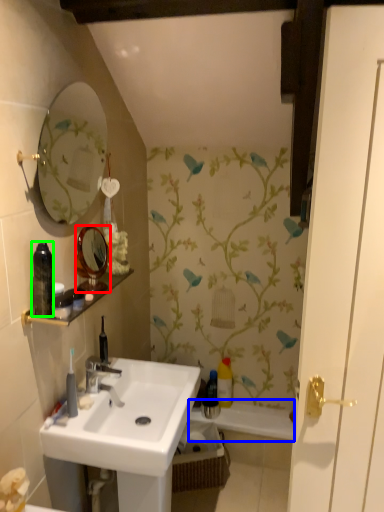
Question: Which is farther away from mirror (highlighted by a red box)? bath (highlighted by a blue box) or toiletry (highlighted by a green box)?

Choices:
 (A) bath
 (B) toiletry

Answer: (A)